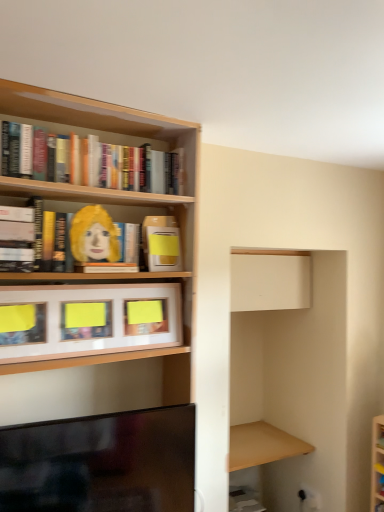
You are a GUI agent. You are given a task and a screenshot of the screen. Output one action in this format:
    pyautogui.click(x=<x>, y=<y>)
    Task: Click on the blank space situated above wooden frame at center, which is the 1th cabinet from left to right (from a real-world perspective)
    The width and height of the screenshot is (384, 512).
    Given the screenshot: What is the action you would take?
    pyautogui.click(x=106, y=280)